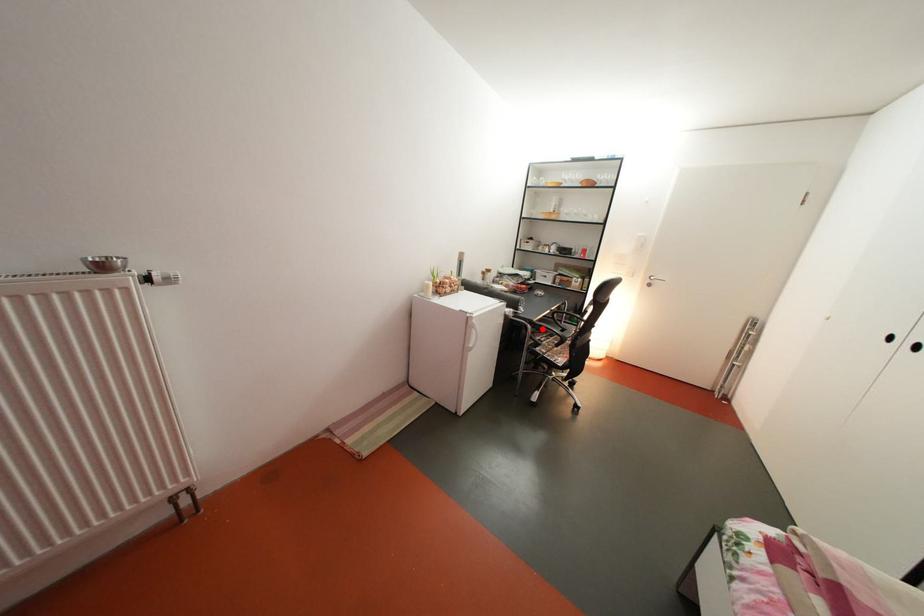
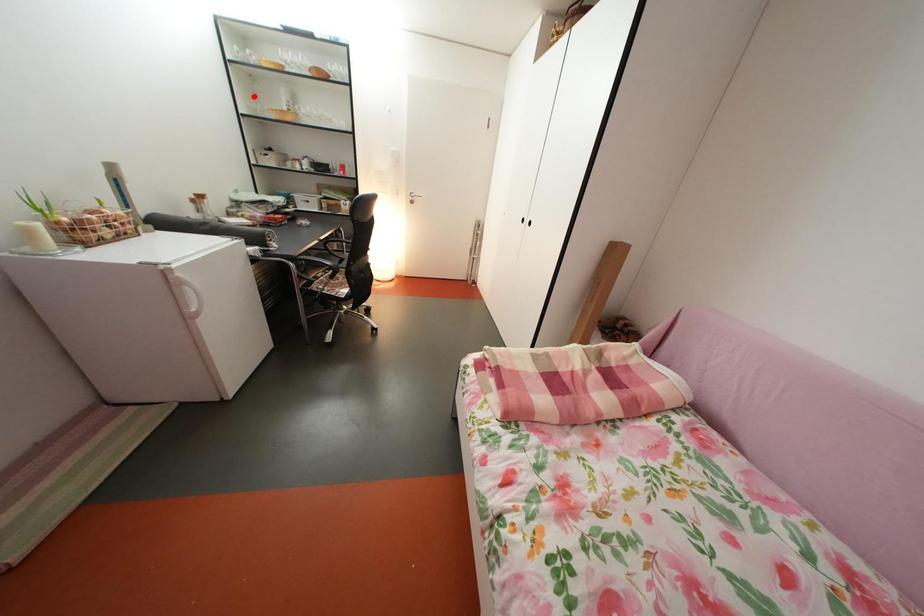
I am providing you with two images of the same scene from different viewpoints. A red point is marked on the first image and another point is marked on the second image. Is the marked point in image1 the same physical position as the marked point in image2?

No